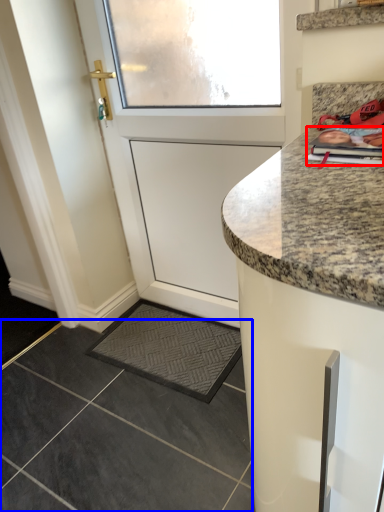
Question: Which object appears farthest to the camera in this image, magazine (highlighted by a red box) or granite (highlighted by a blue box)?

Choices:
 (A) magazine
 (B) granite

Answer: (B)